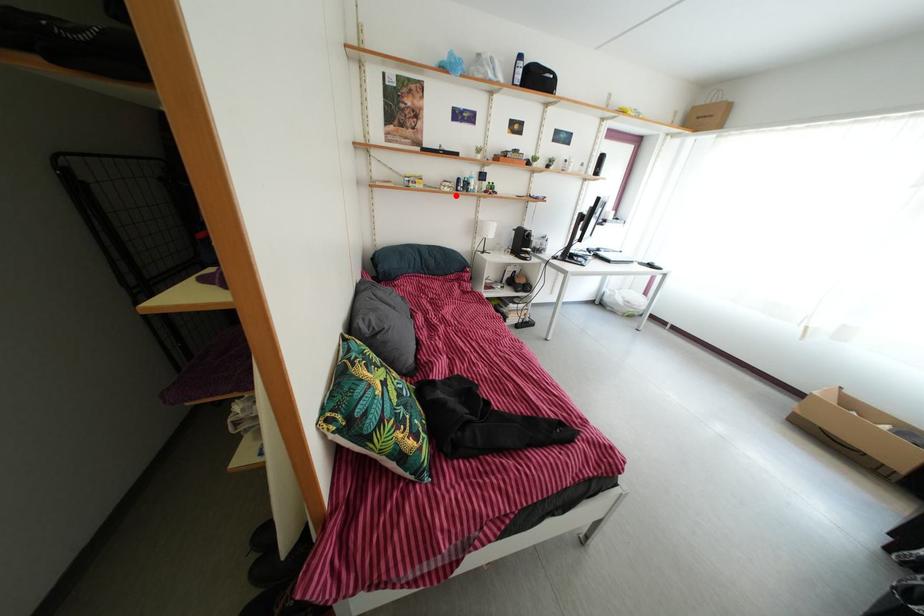
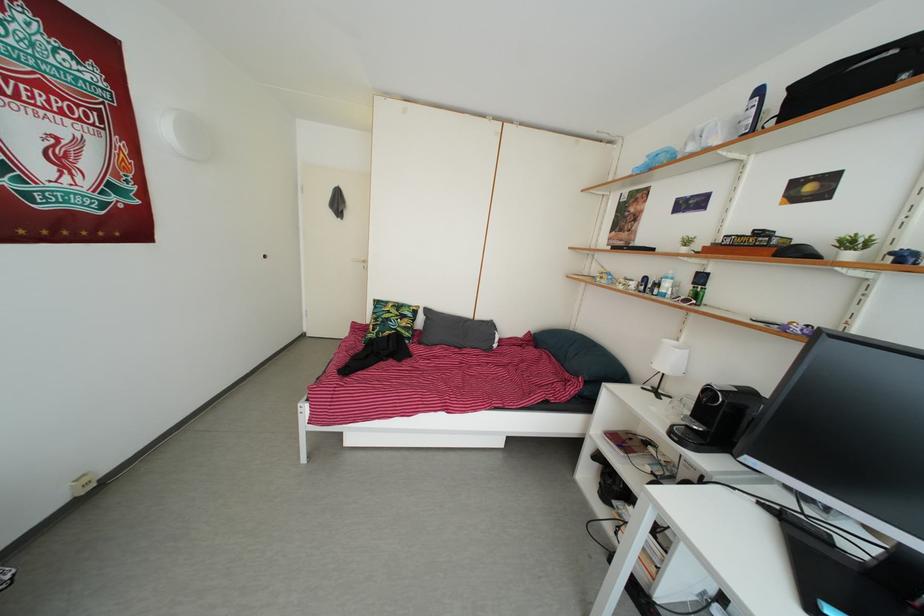
Question: I am providing you with two images of the same scene from different viewpoints. A red point is shown in image1. For the corresponding object point in image2, is it positioned nearer or farther from the camera?

Choices:
 (A) Nearer
 (B) Farther

Answer: (B)